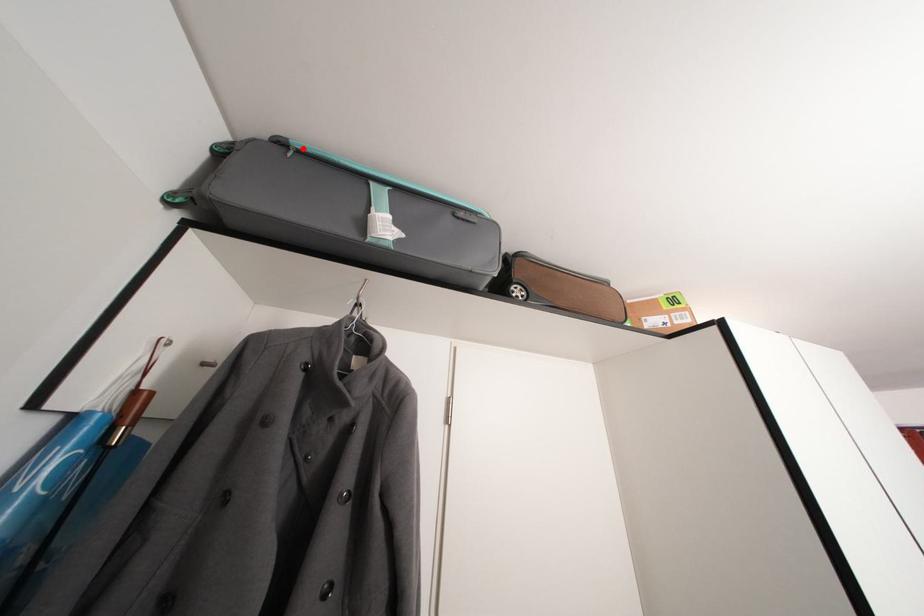
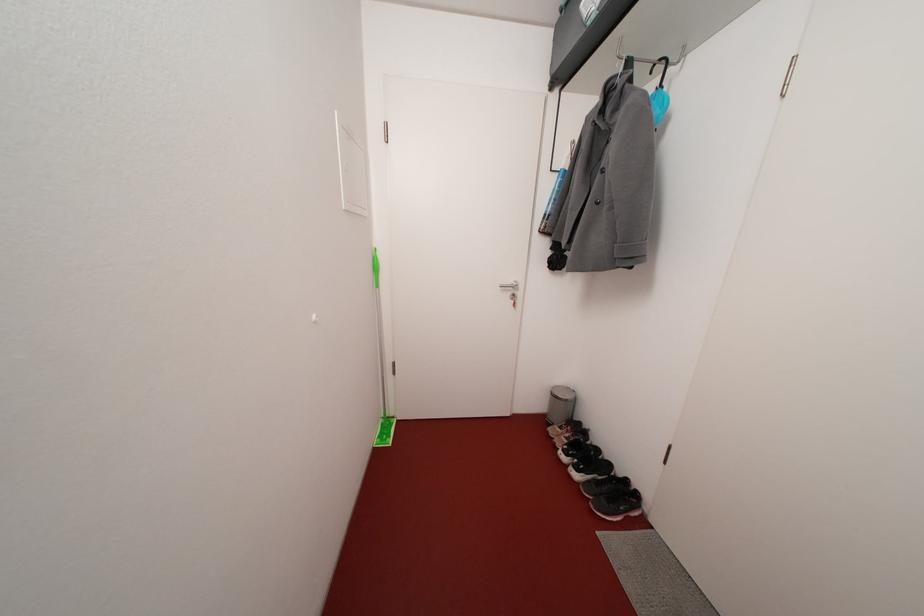
In the second image, find the point that corresponds to the highlighted location in the first image.

(570, 7)